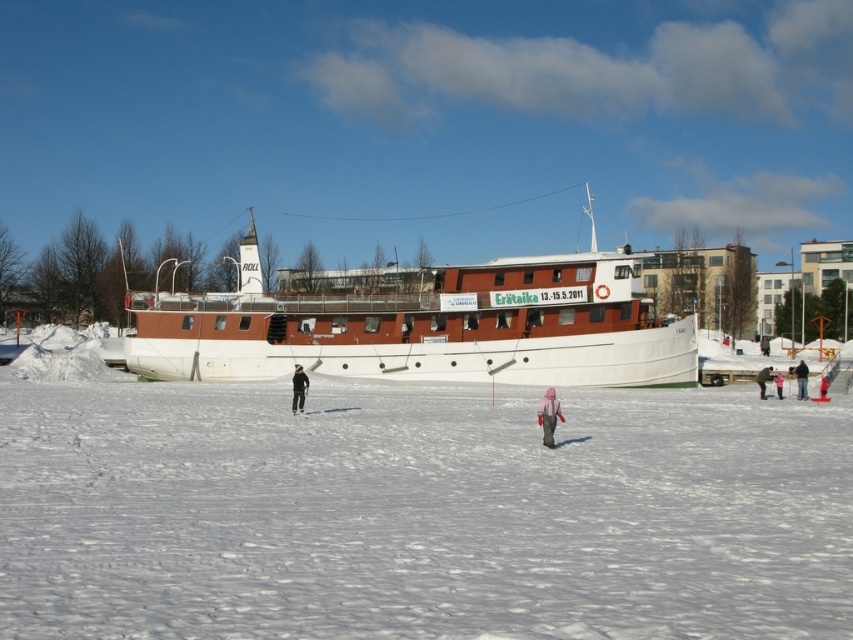
Question: Can you confirm if white powdery snow at center is wider than black matte jacket at center?

Choices:
 (A) no
 (B) yes

Answer: (B)

Question: Is white powdery snow at center bigger than light pink woolen sweater at center?

Choices:
 (A) no
 (B) yes

Answer: (B)

Question: Which object is closer to the camera taking this photo?

Choices:
 (A) dark gray jacket at lower right
 (B) pink fabric jacket at center
 (C) pink fleece jacket at center
 (D) brown matte boat at center

Answer: (C)

Question: Which point appears farthest from the camera in this image?

Choices:
 (A) (549, 388)
 (B) (538, 435)

Answer: (A)

Question: Observing the image, what is the correct spatial positioning of pink fleece jacket at center in reference to black matte jacket at center?

Choices:
 (A) left
 (B) right

Answer: (B)

Question: Which point is farther to the camera?

Choices:
 (A) (593, 301)
 (B) (824, 380)
 (C) (296, 380)
 (D) (404, 420)

Answer: (A)